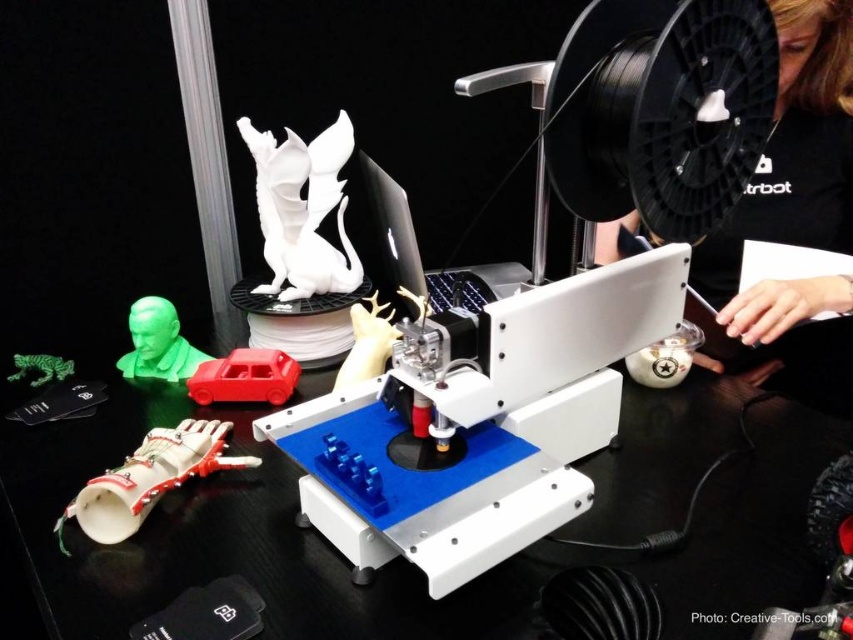
You are a 3D printing enthusiast who wants to place both the matte red car at center and the green matte toy car at left on a shelf. The shelf has a height limit of 10 cm. Can both items fit without exceeding the height limit?

The matte red car at center is taller than the green matte toy car at left. If the shelf has a height limit of 10 cm, both items can only fit if the tallest item, the matte red car at center, is under 10 cm. The answer depends on the exact height of the matte red car at center.

What is the color of the object located at the coordinates point (245, 378)?

The object at point (245, 378) is the matte red car at center.